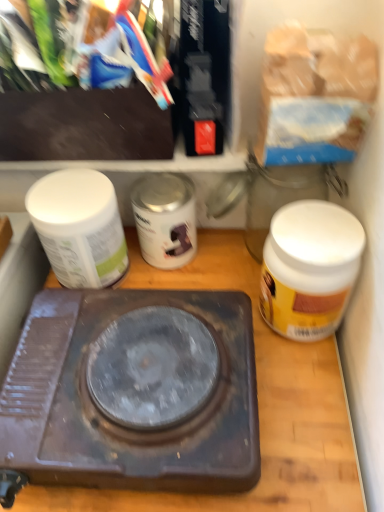
Locate an element on the screen. Image resolution: width=384 pixels, height=512 pixels. empty space that is ontop of rusty metal stove at center (from a real-world perspective) is located at coordinates (121, 369).